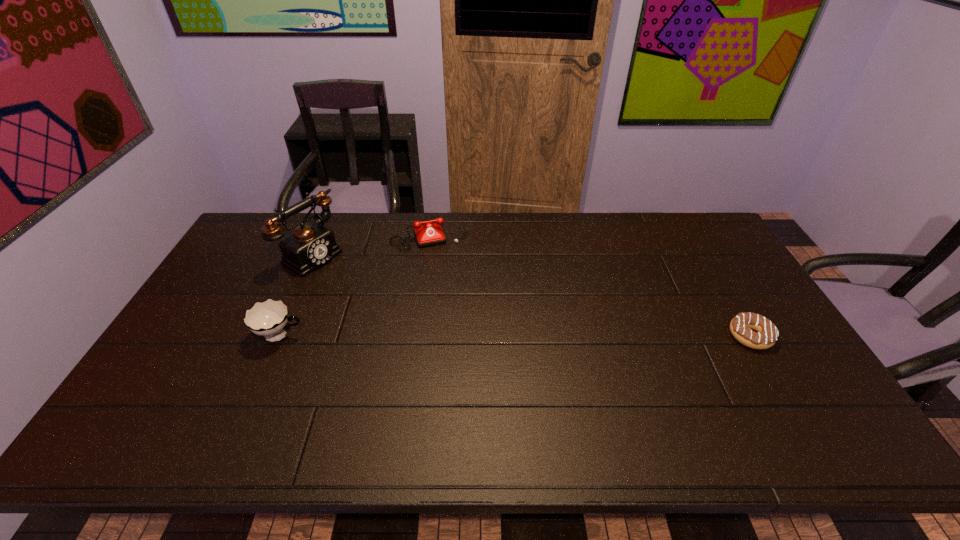
What are the coordinates of `cup` in the screenshot? It's located at (269, 318).

Locate an element on the screen. the rightmost object is located at coordinates (766, 335).

I want to click on doughnut, so click(766, 335).

In order to click on the third tallest object in this screenshot , I will do `click(428, 234)`.

This screenshot has height=540, width=960. I want to click on the third object from left to right, so click(x=428, y=234).

I want to click on the tallest object, so click(312, 245).

Where is `the taller telephone`? This screenshot has width=960, height=540. the taller telephone is located at coordinates (312, 245).

The image size is (960, 540). Find the location of `vacant space located 0.190m on the side of the third shortest object with the handle`. vacant space located 0.190m on the side of the third shortest object with the handle is located at coordinates (373, 336).

At what (x,y) coordinates should I click in order to perform the action: click on vacant space positioned on the back of the rightmost object. Please return your answer as a coordinate pair (x, y). The height and width of the screenshot is (540, 960). Looking at the image, I should click on (724, 292).

Where is `vacant position located 0.290m on the dial of the second shortest object`? The image size is (960, 540). vacant position located 0.290m on the dial of the second shortest object is located at coordinates (459, 309).